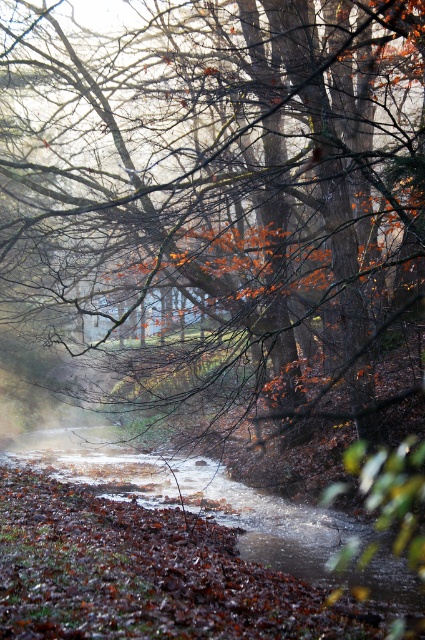
Does brown matte tree at center appear over brown leafy stream at center?

Yes.

Between point (220, 116) and point (82, 449), which one is positioned in front?

Positioned in front is point (220, 116).

Measure the distance between brown matte tree at center and camera.

17.30 feet

This screenshot has width=425, height=640. I want to click on brown matte tree at center, so click(221, 179).